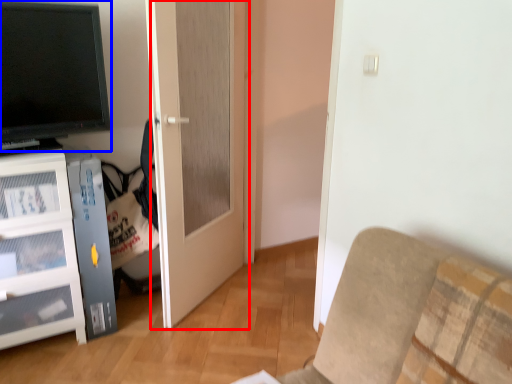
Question: Which point is further to the camera, door (highlighted by a red box) or television (highlighted by a blue box)?

Choices:
 (A) door
 (B) television

Answer: (A)